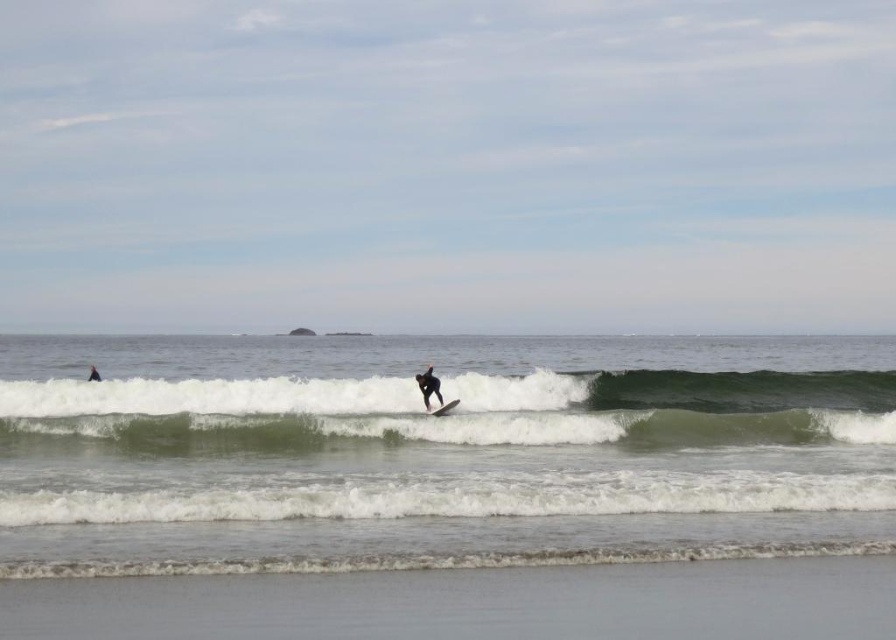
Question: Which is nearer to the clear water at center?

Choices:
 (A) white foam surfboard at center
 (B) black matte surfboard at center

Answer: (B)

Question: Which point is closer to the camera?

Choices:
 (A) clear water at center
 (B) white foam surfboard at center
 (C) black matte surfboard at center

Answer: (A)

Question: Does clear water at center appear on the right side of black matte surfboard at center?

Choices:
 (A) yes
 (B) no

Answer: (B)

Question: In this image, where is black matte surfboard at center located relative to white foam surfboard at center?

Choices:
 (A) above
 (B) below

Answer: (A)

Question: In this image, where is clear water at center located relative to black matte surfboard at center?

Choices:
 (A) left
 (B) right

Answer: (A)

Question: Which of the following is the closest to the observer?

Choices:
 (A) (444, 413)
 (B) (418, 380)
 (C) (547, 509)

Answer: (C)